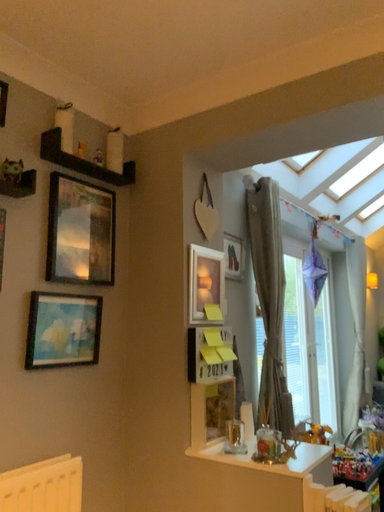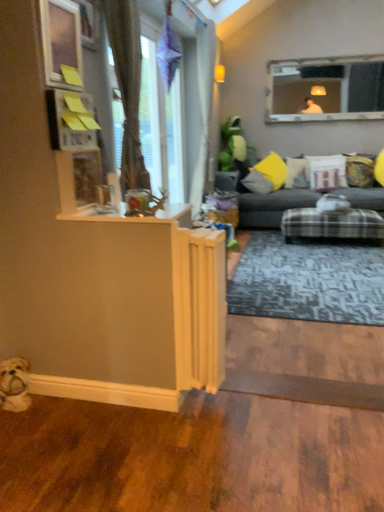
Question: How did the camera likely rotate when shooting the video?

Choices:
 (A) rotated right
 (B) rotated left

Answer: (A)